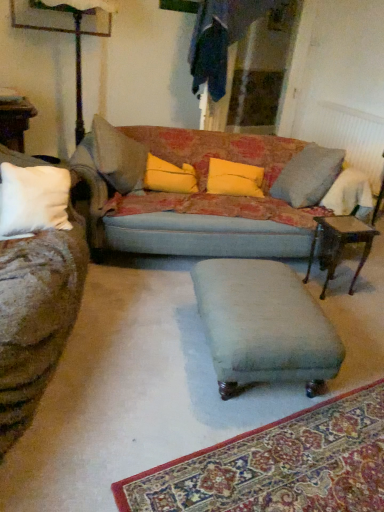
Question: Is point (94, 189) closer or farther from the camera than point (210, 190)?

Choices:
 (A) closer
 (B) farther

Answer: (A)

Question: From the image's perspective, is textured fabric couch at center above or below yellow fabric pillow at center, which ranks as the second pillow in left-to-right order?

Choices:
 (A) above
 (B) below

Answer: (B)

Question: Which object is the closest to the textured fabric couch at center?

Choices:
 (A) yellow fabric pillow at center, placed as the 2th pillow when sorted from right to left
 (B) white textured radiator at upper right
 (C) yellow fabric pillow at center, which ranks as the second pillow in left-to-right order
 (D) wooden side table at right
 (E) velvet teal footrest at center

Answer: (A)

Question: Estimate the real-world distances between objects in this image. Which object is farther from the yellow fabric pillow at center, placed as the 1th pillow when sorted from right to left?

Choices:
 (A) wooden side table at right
 (B) velvet teal footrest at center
 (C) textured fabric couch at center
 (D) white textured radiator at upper right
 (E) yellow fabric pillow at center, placed as the 2th pillow when sorted from right to left

Answer: (D)